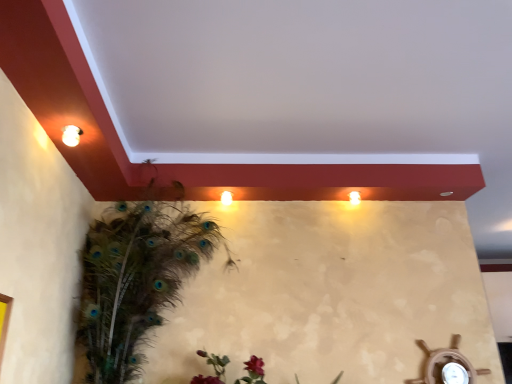
Question: From the image's perspective, is matte white light fixture at upper left above or below feathered peacock at left?

Choices:
 (A) above
 (B) below

Answer: (A)

Question: Is matte white light fixture at upper left bigger or smaller than feathered peacock at left?

Choices:
 (A) small
 (B) big

Answer: (A)

Question: Estimate the real-world distances between objects in this image. Which object is farther from the feathered peacock at left?

Choices:
 (A) matte white light fixture at upper left
 (B) matte white light at upper right

Answer: (B)

Question: Which is farther from the matte white light fixture at upper left?

Choices:
 (A) feathered peacock at left
 (B) matte white light at upper right

Answer: (B)